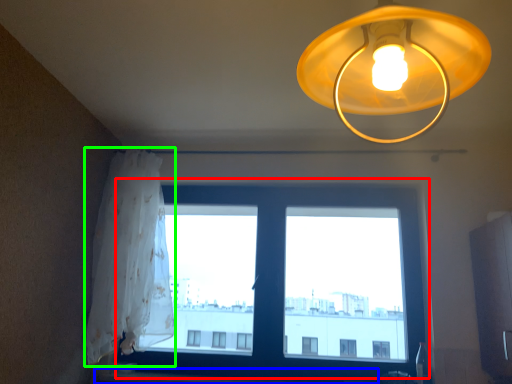
Question: Which is nearer to the window (highlighted by a red box)? window sill (highlighted by a blue box) or curtain (highlighted by a green box).

Choices:
 (A) window sill
 (B) curtain

Answer: (B)